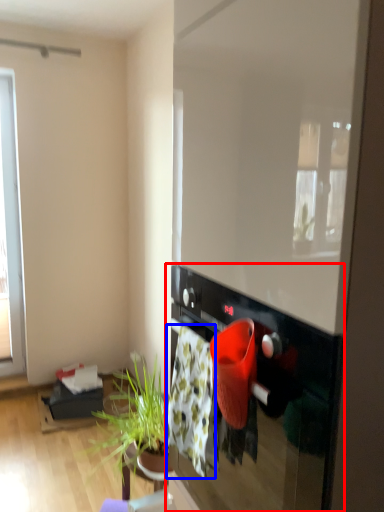
Question: Among these objects, which one is nearest to the camera, oven (highlighted by a red box) or blanket (highlighted by a blue box)?

Choices:
 (A) oven
 (B) blanket

Answer: (A)